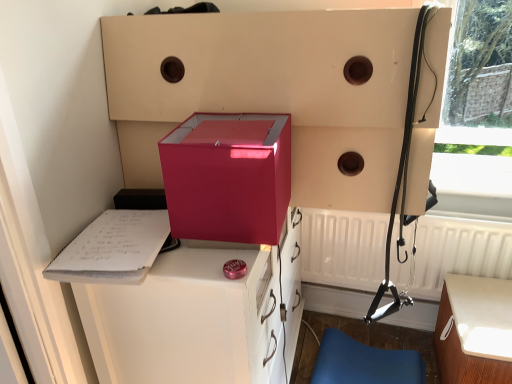
Question: From the image's perspective, is white matte radiator at lower right under matte black harness at right?

Choices:
 (A) yes
 (B) no

Answer: (A)

Question: Is white matte radiator at lower right to the right of matte black harness at right from the viewer's perspective?

Choices:
 (A) no
 (B) yes

Answer: (B)

Question: Can you confirm if white matte radiator at lower right is shorter than matte black harness at right?

Choices:
 (A) yes
 (B) no

Answer: (A)

Question: Is matte black harness at right a part of white matte radiator at lower right?

Choices:
 (A) yes
 (B) no

Answer: (B)

Question: Is white matte radiator at lower right at the left side of matte black harness at right?

Choices:
 (A) yes
 (B) no

Answer: (B)

Question: Based on their positions, is matte pink box at center located to the left or right of glossy plastic vanity at center?

Choices:
 (A) right
 (B) left

Answer: (A)

Question: Considering the positions of matte pink box at center and glossy plastic vanity at center in the image, is matte pink box at center taller or shorter than glossy plastic vanity at center?

Choices:
 (A) tall
 (B) short

Answer: (B)

Question: In terms of width, does matte pink box at center look wider or thinner when compared to glossy plastic vanity at center?

Choices:
 (A) thin
 (B) wide

Answer: (A)

Question: Does point (169, 195) appear closer or farther from the camera than point (201, 359)?

Choices:
 (A) closer
 (B) farther

Answer: (A)

Question: Based on their positions, is white wood table at lower right located to the left or right of white paper clipboard at left?

Choices:
 (A) left
 (B) right

Answer: (B)

Question: Considering the positions of point (507, 355) and point (144, 210), is point (507, 355) closer or farther from the camera than point (144, 210)?

Choices:
 (A) farther
 (B) closer

Answer: (A)

Question: Is white wood table at lower right wider or thinner than white paper clipboard at left?

Choices:
 (A) wide
 (B) thin

Answer: (A)

Question: Is white wood table at lower right situated inside white paper clipboard at left or outside?

Choices:
 (A) inside
 (B) outside

Answer: (B)

Question: Is blue leather chair at lower right wider or thinner than matte pink box at center?

Choices:
 (A) thin
 (B) wide

Answer: (B)

Question: Considering the positions of blue leather chair at lower right and matte pink box at center in the image, is blue leather chair at lower right taller or shorter than matte pink box at center?

Choices:
 (A) tall
 (B) short

Answer: (B)